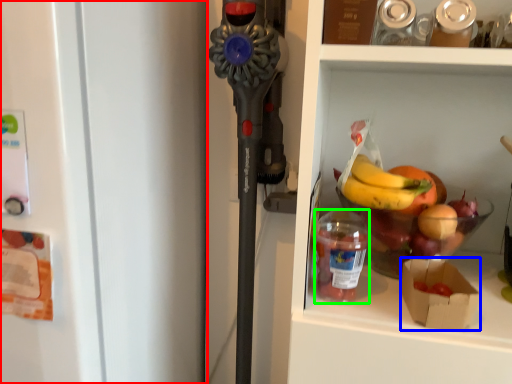
Question: Estimate the real-world distances between objects in this image. Which object is farther from refrigerator (highlighted by a red box), box (highlighted by a blue box) or bottle (highlighted by a green box)?

Choices:
 (A) box
 (B) bottle

Answer: (A)